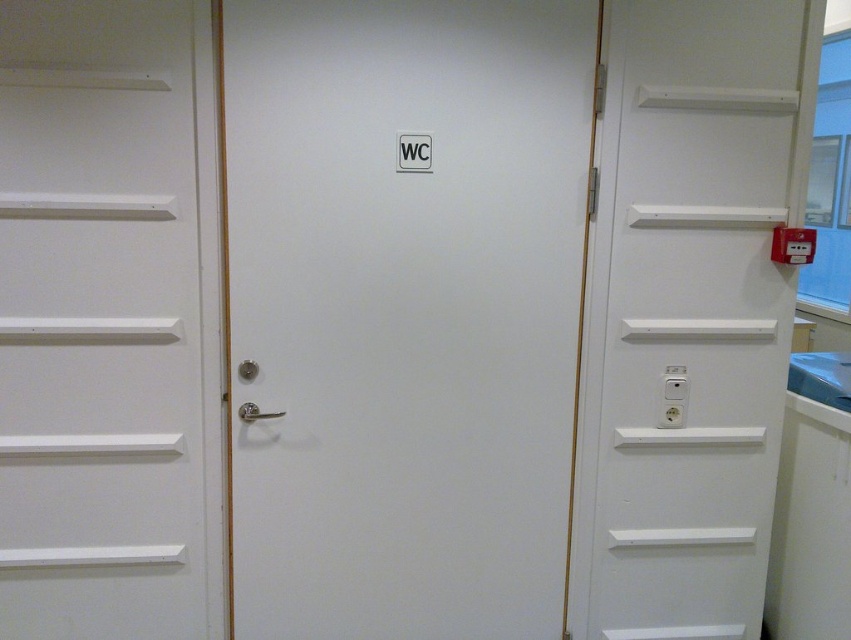
Question: Which object appears farthest from the camera in this image?

Choices:
 (A) white matte door at center
 (B) white matte door at right
 (C) white matte door at left

Answer: (B)

Question: Which is farther from the white matte door at left?

Choices:
 (A) white matte door at center
 (B) white matte door at right

Answer: (B)

Question: Which object is positioned closest to the white matte door at center?

Choices:
 (A) white matte door at right
 (B) white matte door at left

Answer: (B)

Question: From the image, what is the correct spatial relationship of white matte door at left in relation to white matte door at right?

Choices:
 (A) right
 (B) left

Answer: (B)

Question: From the image, what is the correct spatial relationship of white matte door at center in relation to white matte door at left?

Choices:
 (A) above
 (B) below

Answer: (A)

Question: Observing the image, what is the correct spatial positioning of white matte door at center in reference to white matte door at left?

Choices:
 (A) right
 (B) left

Answer: (A)